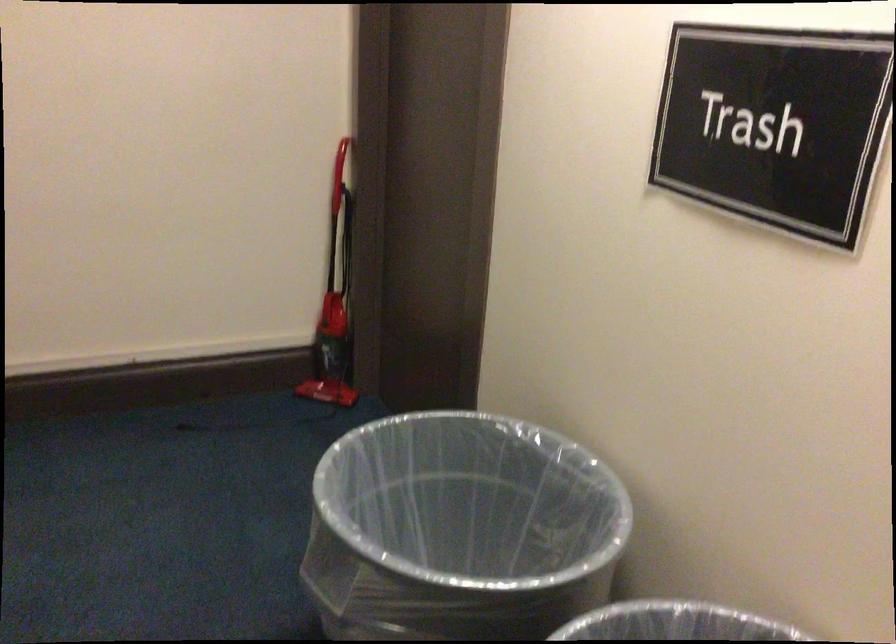
The width and height of the screenshot is (896, 644). Find the location of `metal trash can`. metal trash can is located at coordinates (460, 529).